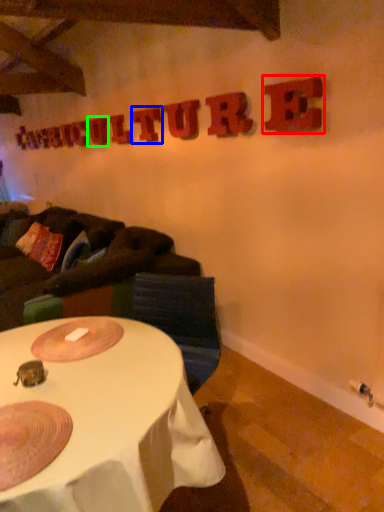
Question: Considering the real-world distances, which object is closest to letter (highlighted by a red box)? letter (highlighted by a blue box) or letter (highlighted by a green box).

Choices:
 (A) letter
 (B) letter

Answer: (A)